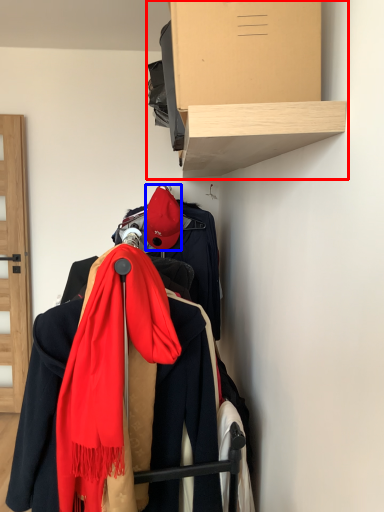
Question: Which object is further to the camera taking this photo, shelf (highlighted by a red box) or hat (highlighted by a blue box)?

Choices:
 (A) shelf
 (B) hat

Answer: (B)